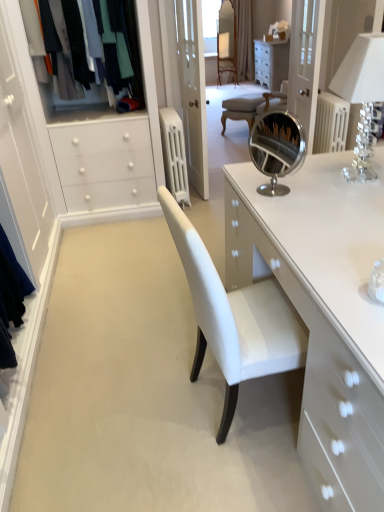
The image size is (384, 512). I want to click on white leather chair at center, so click(x=251, y=105).

Is clear crystal lampshade at upper right aimed at beige textured curtain at upper center?

No, clear crystal lampshade at upper right is not turned towards beige textured curtain at upper center.

Does point (362, 42) appear closer or farther from the camera than point (249, 35)?

Point (362, 42).

From the image's perspective, is clear crystal lampshade at upper right on top of beige textured curtain at upper center?

Actually, clear crystal lampshade at upper right appears below beige textured curtain at upper center in the image.

Who is taller, white painted metal radiator at center or matte black clothes at left?

Standing taller between the two is matte black clothes at left.

Relative to matte black clothes at left, is white painted metal radiator at center in front or behind?

Visually, white painted metal radiator at center is located behind matte black clothes at left.

From the picture: Would you say white painted metal radiator at center contains matte black clothes at left?

No, matte black clothes at left is located outside of white painted metal radiator at center.

Where is `clothing that appears on the left of white painted metal radiator at center`? clothing that appears on the left of white painted metal radiator at center is located at coordinates (123, 50).

Between matte black clothes at left and clear crystal lampshade at upper right, which one has larger size?

Bigger between the two is matte black clothes at left.

Locate an element on the screen. The width and height of the screenshot is (384, 512). table lamp below the matte black clothes at left (from the image's perspective) is located at coordinates (362, 95).

From the image's perspective, is matte black clothes at left located above or below clear crystal lampshade at upper right?

Clearly, from the image's perspective, matte black clothes at left is above clear crystal lampshade at upper right.

Is matte black clothes at left taller or shorter than clear crystal lampshade at upper right?

Clearly, matte black clothes at left is taller compared to clear crystal lampshade at upper right.

Which is closer to the camera, (383, 77) or (170, 164)?

Point (383, 77).

Between clear crystal lampshade at upper right and white painted metal radiator at center, which one has larger width?

white painted metal radiator at center is wider.

Is clear crystal lampshade at upper right oriented away from white painted metal radiator at center?

clear crystal lampshade at upper right is not turned away from white painted metal radiator at center.

Is clear crystal lampshade at upper right positioned before white painted metal radiator at center?

Yes, clear crystal lampshade at upper right is closer to the viewer.

Is point (234, 35) closer to camera compared to point (299, 26)?

No, (234, 35) is further to viewer.

You are a GUI agent. You are given a task and a screenshot of the screen. Output one action in this format:
    pyautogui.click(x=<x>, y=<y>)
    Task: Click on the armchair below the clear glass door at upper center (from a real-world perspective)
    
    Given the screenshot: What is the action you would take?
    pyautogui.click(x=226, y=55)

Is clear glass door at upper center inside mahogany wood armchair at upper center?

No, clear glass door at upper center is not inside mahogany wood armchair at upper center.

From the image's perspective, which one is positioned higher, mahogany wood armchair at upper center or clear glass door at upper center?

mahogany wood armchair at upper center.

Looking at this image, considering the relative sizes of mahogany wood armchair at upper center and clear crystal lampshade at upper right in the image provided, is mahogany wood armchair at upper center smaller than clear crystal lampshade at upper right?

Incorrect, mahogany wood armchair at upper center is not smaller in size than clear crystal lampshade at upper right.

Is mahogany wood armchair at upper center far from clear crystal lampshade at upper right?

Yes, mahogany wood armchair at upper center and clear crystal lampshade at upper right are located far from each other.

From the image's perspective, is mahogany wood armchair at upper center on top of clear crystal lampshade at upper right?

Yes, from the image's perspective, mahogany wood armchair at upper center is above clear crystal lampshade at upper right.

The height and width of the screenshot is (512, 384). Find the location of `armchair beneath the clear crystal lampshade at upper right (from a real-world perspective)`. armchair beneath the clear crystal lampshade at upper right (from a real-world perspective) is located at coordinates (226, 55).

Does clear crystal lampshade at upper right have a greater width compared to white leather chair at center?

Incorrect, the width of clear crystal lampshade at upper right does not surpass that of white leather chair at center.

Could you tell me if clear crystal lampshade at upper right is turned towards white leather chair at center?

No.

Find the location of a particular element. The height and width of the screenshot is (512, 384). table lamp below the beige textured curtain at upper center (from the image's perspective) is located at coordinates (362, 95).

The image size is (384, 512). Identify the location of radiator on the right of matte black clothes at left. (174, 155).

Which object lies nearer to the anchor point mahogany wood armchair at upper center, clear crystal lampshade at upper right or beige textured curtain at upper center?

Among the two, beige textured curtain at upper center is located nearer to mahogany wood armchair at upper center.

Considering their positions, is mahogany wood armchair at upper center positioned further to beige textured curtain at upper center than white painted metal radiator at center?

Based on the image, white painted metal radiator at center appears to be further to beige textured curtain at upper center.

Based on their spatial positions, is mahogany wood armchair at upper center or white painted metal radiator at center closer to clear crystal lampshade at upper right?

Based on the image, white painted metal radiator at center appears to be nearer to clear crystal lampshade at upper right.

Which object lies further to the anchor point beige textured curtain at upper center, white leather chair at center or white painted metal radiator at center?

The object further to beige textured curtain at upper center is white painted metal radiator at center.

From the image, which object appears to be farther from white leather chair at center, beige textured curtain at upper center or clear glass door at upper center?

The object further to white leather chair at center is beige textured curtain at upper center.

Which object lies nearer to the anchor point clear glass door at upper center, beige textured curtain at upper center or mahogany wood armchair at upper center?

beige textured curtain at upper center is closer to clear glass door at upper center.

Considering their positions, is white painted metal radiator at center positioned closer to matte black clothes at left than clear glass door at upper center?

white painted metal radiator at center.

Estimate the real-world distances between objects in this image. Which object is further from white painted metal radiator at center, beige textured curtain at upper center or mahogany wood armchair at upper center?

Based on the image, beige textured curtain at upper center appears to be further to white painted metal radiator at center.

At what (x,y) coordinates should I click in order to perform the action: click on chair between clear crystal lampshade at upper right and beige textured curtain at upper center in the front-back direction. Please return your answer as a coordinate pair (x, y). This screenshot has height=512, width=384. Looking at the image, I should click on (251, 105).

Image resolution: width=384 pixels, height=512 pixels. Identify the location of radiator located between clear crystal lampshade at upper right and beige textured curtain at upper center in the depth direction. (174, 155).

Image resolution: width=384 pixels, height=512 pixels. Identify the location of chair positioned between matte black clothes at left and beige textured curtain at upper center from near to far. (251, 105).

Where is `armchair between white painted metal radiator at center and beige textured curtain at upper center along the z-axis`? armchair between white painted metal radiator at center and beige textured curtain at upper center along the z-axis is located at coordinates (226, 55).